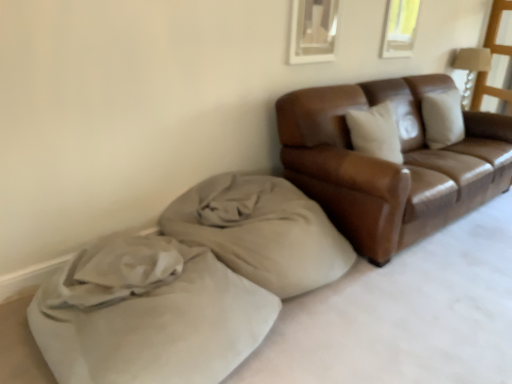
Question: Considering the relative positions of brown leather couch at right and beige fabric cushion at lower left in the image provided, is brown leather couch at right to the left of beige fabric cushion at lower left from the viewer's perspective?

Choices:
 (A) no
 (B) yes

Answer: (A)

Question: Would you say brown leather couch at right contains beige fabric cushion at lower left?

Choices:
 (A) no
 (B) yes

Answer: (A)

Question: From the image's perspective, is brown leather couch at right located above beige fabric cushion at lower left?

Choices:
 (A) no
 (B) yes

Answer: (B)

Question: From a real-world perspective, is brown leather couch at right on beige fabric cushion at lower left?

Choices:
 (A) yes
 (B) no

Answer: (A)

Question: Is brown leather couch at right bigger than beige fabric cushion at lower left?

Choices:
 (A) yes
 (B) no

Answer: (A)

Question: From the image's perspective, relative to beige suede bean bag at lower left, is transparent plastic window screen at upper right above or below?

Choices:
 (A) below
 (B) above

Answer: (B)

Question: Considering the positions of transparent plastic window screen at upper right and beige suede bean bag at lower left in the image, is transparent plastic window screen at upper right wider or thinner than beige suede bean bag at lower left?

Choices:
 (A) thin
 (B) wide

Answer: (A)

Question: In terms of height, does transparent plastic window screen at upper right look taller or shorter compared to beige suede bean bag at lower left?

Choices:
 (A) short
 (B) tall

Answer: (B)

Question: From a real-world perspective, is transparent plastic window screen at upper right physically located above or below beige suede bean bag at lower left?

Choices:
 (A) above
 (B) below

Answer: (A)

Question: From a real-world perspective, relative to transparent plastic window screen at upper right, is beige fabric cushion at lower left vertically above or below?

Choices:
 (A) above
 (B) below

Answer: (B)

Question: In terms of size, does beige fabric cushion at lower left appear bigger or smaller than transparent plastic window screen at upper right?

Choices:
 (A) small
 (B) big

Answer: (B)

Question: From the image's perspective, is beige fabric cushion at lower left positioned above or below transparent plastic window screen at upper right?

Choices:
 (A) above
 (B) below

Answer: (B)

Question: Considering the relative positions of beige fabric cushion at lower left and transparent plastic window screen at upper right in the image provided, is beige fabric cushion at lower left to the left or to the right of transparent plastic window screen at upper right?

Choices:
 (A) left
 (B) right

Answer: (A)

Question: Is point (482, 69) positioned closer to the camera than point (462, 165)?

Choices:
 (A) farther
 (B) closer

Answer: (A)

Question: From their relative heights in the image, would you say matte brown wooden lamp at upper right is taller or shorter than brown leather couch at right?

Choices:
 (A) short
 (B) tall

Answer: (A)